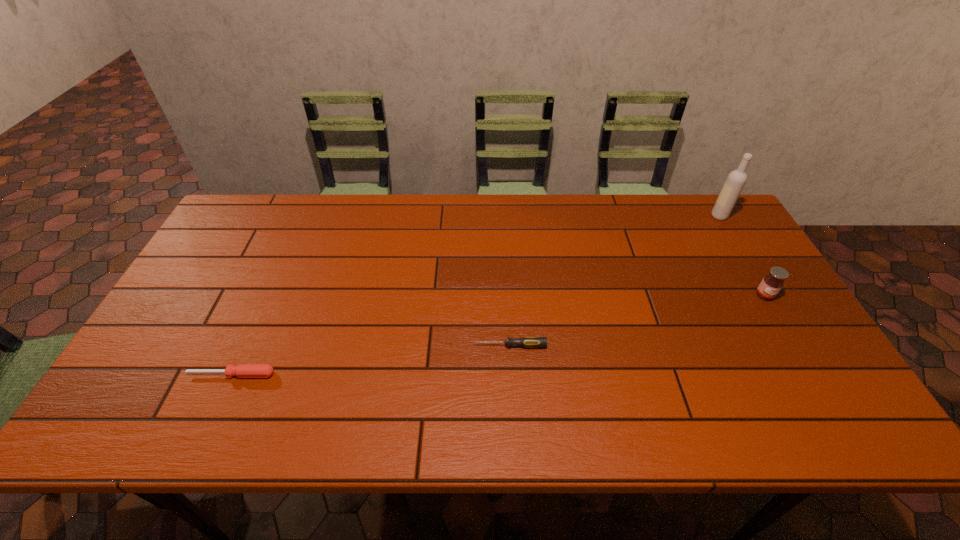
The height and width of the screenshot is (540, 960). I want to click on vacant area between the third farthest object and the third shortest object, so (636, 320).

Where is `free space between the vodka and the left screwdriver`? free space between the vodka and the left screwdriver is located at coordinates (475, 295).

At what (x,y) coordinates should I click in order to perform the action: click on vacant point located between the left screwdriver and the second object from left to right. Please return your answer as a coordinate pair (x, y). Looking at the image, I should click on coord(371,360).

This screenshot has height=540, width=960. What are the coordinates of `empty location between the jam and the farther screwdriver` in the screenshot? It's located at (636, 320).

Locate an element on the screen. This screenshot has height=540, width=960. free space that is in between the farthest object and the leftmost object is located at coordinates (475, 295).

This screenshot has width=960, height=540. What are the coordinates of `object identified as the closest to the second nearest object` in the screenshot? It's located at (242, 370).

Locate which object is the closest to the third farthest object. Please provide its 2D coordinates. Your answer should be formatted as a tuple, i.e. [(x, y)], where the tuple contains the x and y coordinates of a point satisfying the conditions above.

[(242, 370)]

Find the location of a particular element. The width and height of the screenshot is (960, 540). vacant point that satisfies the following two spatial constraints: 1. on the label side of the jam; 2. insert the second nearest object into a screw head is located at coordinates (795, 345).

The height and width of the screenshot is (540, 960). I want to click on free location that satisfies the following two spatial constraints: 1. on the label side of the third shortest object; 2. insert the second nearest object into a screw head, so click(795, 345).

This screenshot has width=960, height=540. Identify the location of vacant space that satisfies the following two spatial constraints: 1. on the front side of the vodka; 2. insert the farther screwdriver into a screw head. (797, 345).